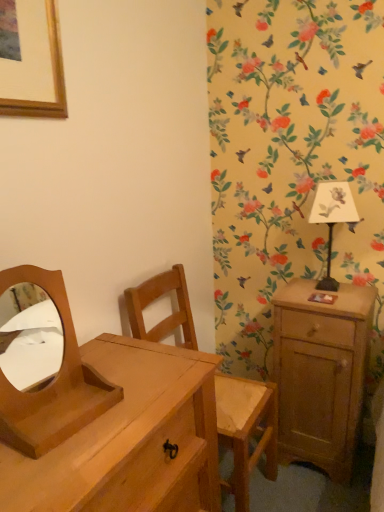
Question: Can we say white paper lampshade at upper right lies outside wooden/matte mirror at left?

Choices:
 (A) no
 (B) yes

Answer: (B)

Question: Does white paper lampshade at upper right have a greater height compared to wooden/matte mirror at left?

Choices:
 (A) no
 (B) yes

Answer: (B)

Question: From a real-world perspective, is white paper lampshade at upper right below wooden/matte mirror at left?

Choices:
 (A) no
 (B) yes

Answer: (A)

Question: Is white paper lampshade at upper right to the left of wooden/matte mirror at left from the viewer's perspective?

Choices:
 (A) yes
 (B) no

Answer: (B)

Question: From a real-world perspective, is white paper lampshade at upper right over wooden/matte mirror at left?

Choices:
 (A) no
 (B) yes

Answer: (B)

Question: Does white paper lampshade at upper right have a lesser height compared to wooden/matte mirror at left?

Choices:
 (A) yes
 (B) no

Answer: (B)

Question: Is light brown wood nightstand at right in front of light brown wooden chest of drawers at lower left?

Choices:
 (A) yes
 (B) no

Answer: (B)

Question: Is light brown wooden chest of drawers at lower left at the back of light brown wood nightstand at right?

Choices:
 (A) no
 (B) yes

Answer: (A)

Question: Is light brown wood nightstand at right wider than light brown wooden chest of drawers at lower left?

Choices:
 (A) yes
 (B) no

Answer: (B)

Question: Can you confirm if light brown wood nightstand at right is thinner than light brown wooden chest of drawers at lower left?

Choices:
 (A) yes
 (B) no

Answer: (A)

Question: Can you confirm if light brown wood nightstand at right is smaller than light brown wooden chest of drawers at lower left?

Choices:
 (A) no
 (B) yes

Answer: (B)

Question: Can you confirm if light brown wood nightstand at right is bigger than light brown wooden chest of drawers at lower left?

Choices:
 (A) no
 (B) yes

Answer: (A)

Question: Does light brown wood nightstand at right have a smaller size compared to white paper lampshade at upper right?

Choices:
 (A) no
 (B) yes

Answer: (A)